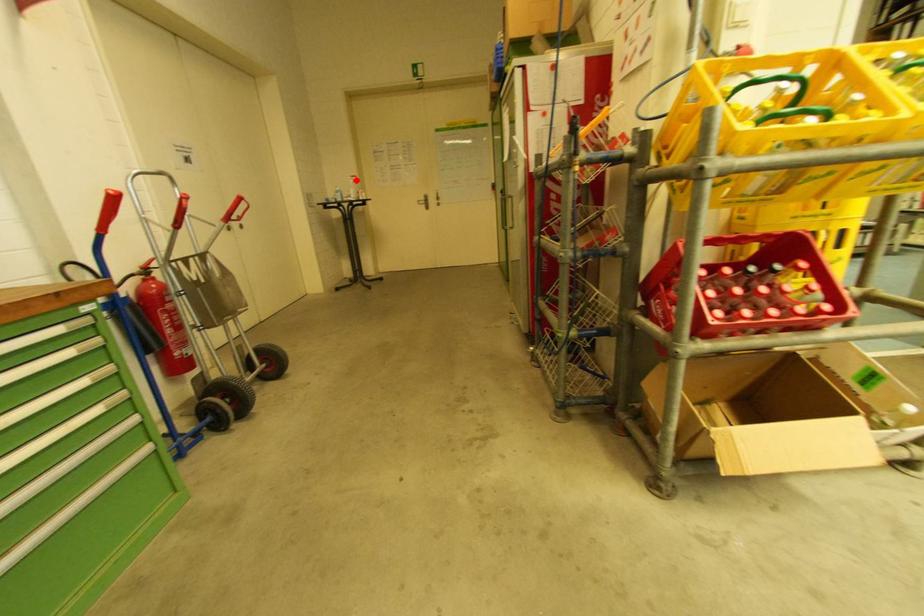
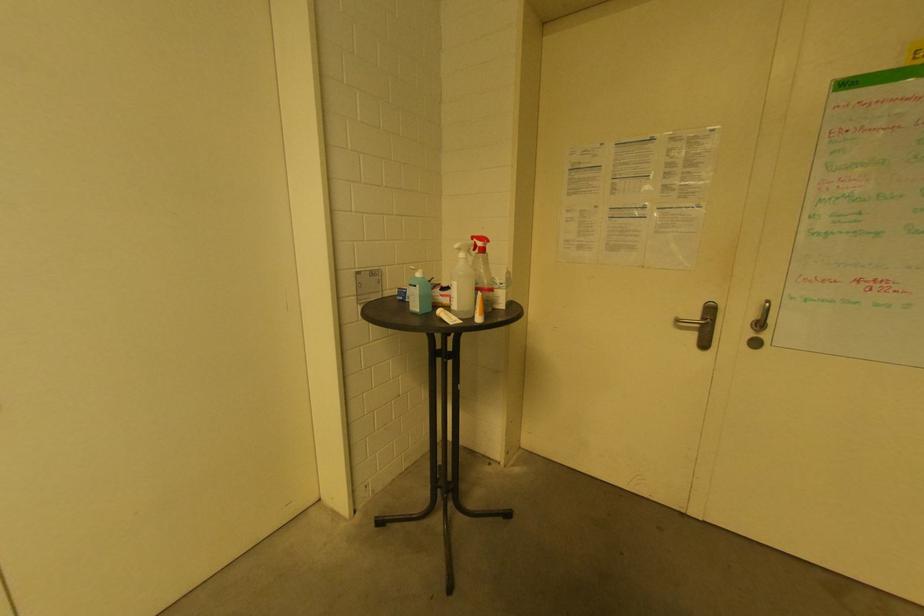
In the second image, find the point that corresponds to the highlighted location in the first image.

(481, 245)